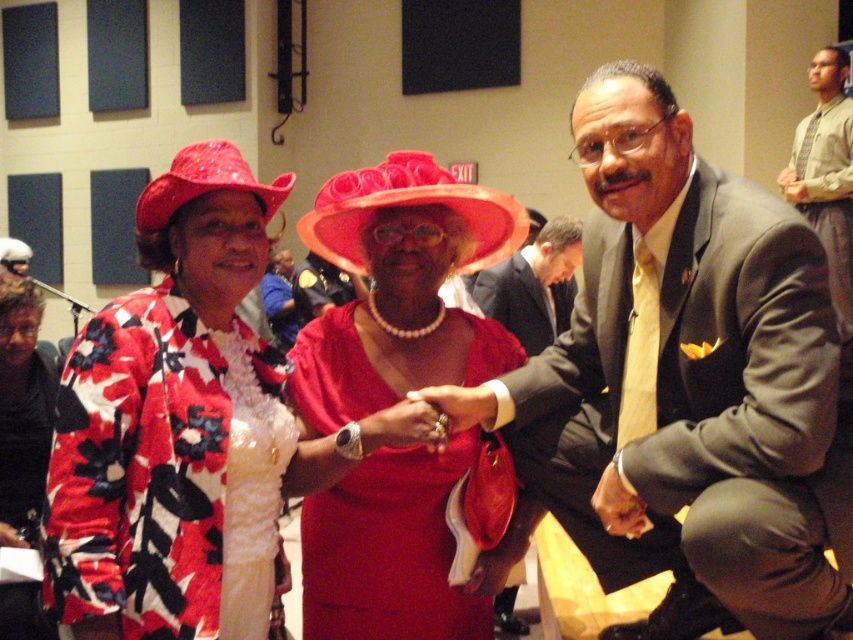
Question: Can you confirm if floral-patterned fabric dress at left is thinner than light beige textured suit at right?

Choices:
 (A) no
 (B) yes

Answer: (B)

Question: Which point is farther to the camera?

Choices:
 (A) (393, 435)
 (B) (268, 397)
 (C) (848, 241)

Answer: (C)

Question: Can you confirm if white satin dress at center is positioned to the right of shiny fabric hat at center?

Choices:
 (A) yes
 (B) no

Answer: (B)

Question: Which object is the closest to the light beige textured suit at right?

Choices:
 (A) matte black suit at center
 (B) shiny red dress at center
 (C) shiny fabric hat at center

Answer: (A)

Question: Is matte gray suit at center smaller than shiny red dress at center?

Choices:
 (A) yes
 (B) no

Answer: (B)

Question: Estimate the real-world distances between objects in this image. Which object is farther from the smooth leather hand at center?

Choices:
 (A) shiny red hat at upper left
 (B) matte red purse at center
 (C) matte gold ring at center

Answer: (A)